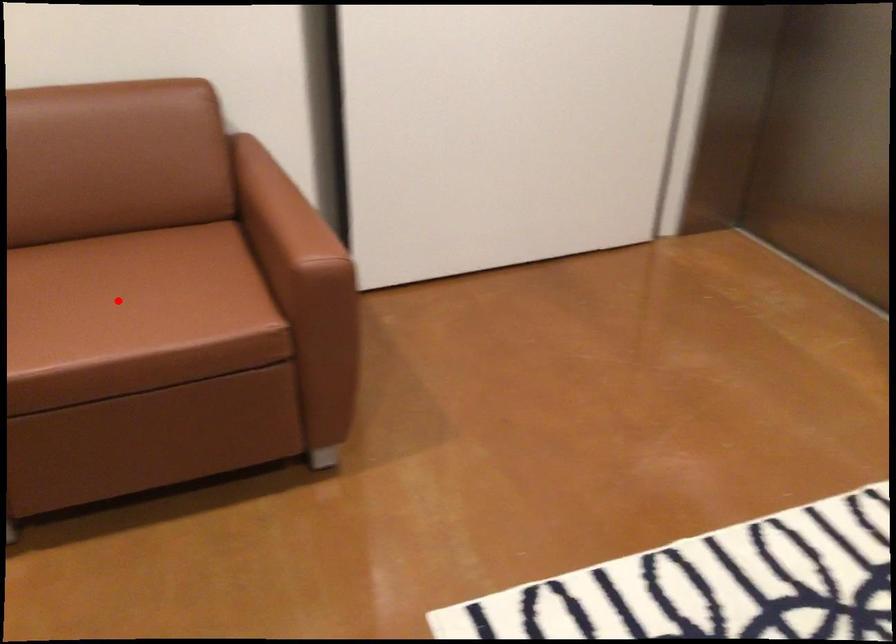
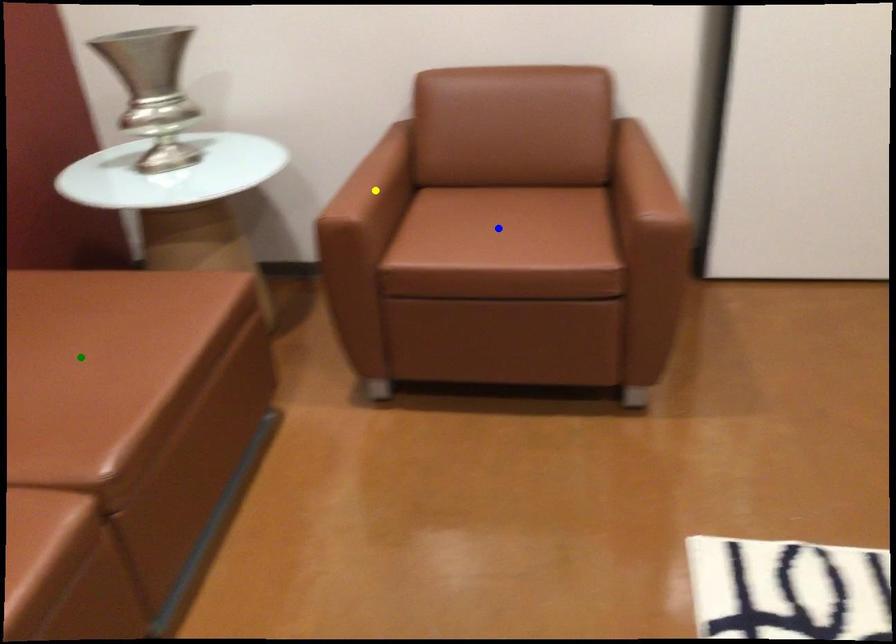
Question: I am providing you with two images of the same scene from different viewpoints. A red point is marked on the first image. You are given multiple points on the second image. Which mark in image 2 goes with the point in image 1?

Choices:
 (A) yellow point
 (B) green point
 (C) blue point

Answer: (C)